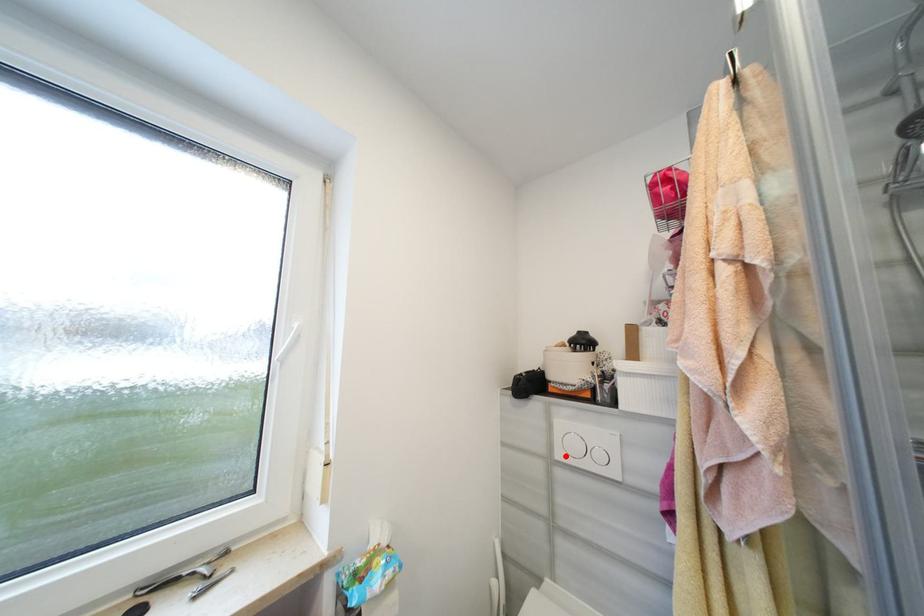
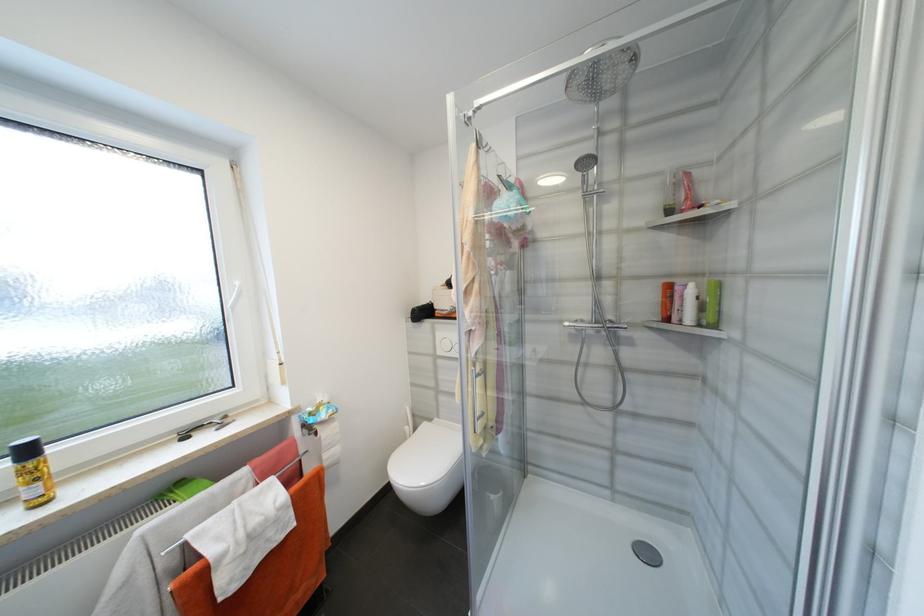
In the second image, find the point that corresponds to the highlighted location in the first image.

(445, 353)